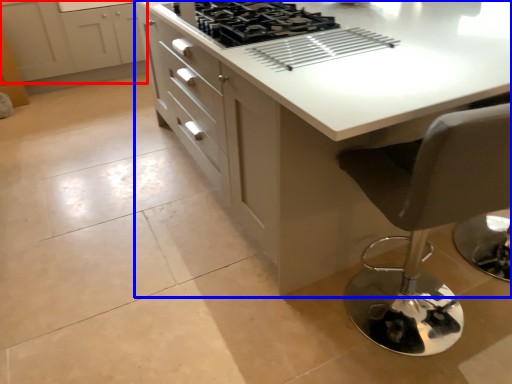
Question: Among these objects, which one is farthest to the camera, cabinetry (highlighted by a red box) or countertop (highlighted by a blue box)?

Choices:
 (A) cabinetry
 (B) countertop

Answer: (A)